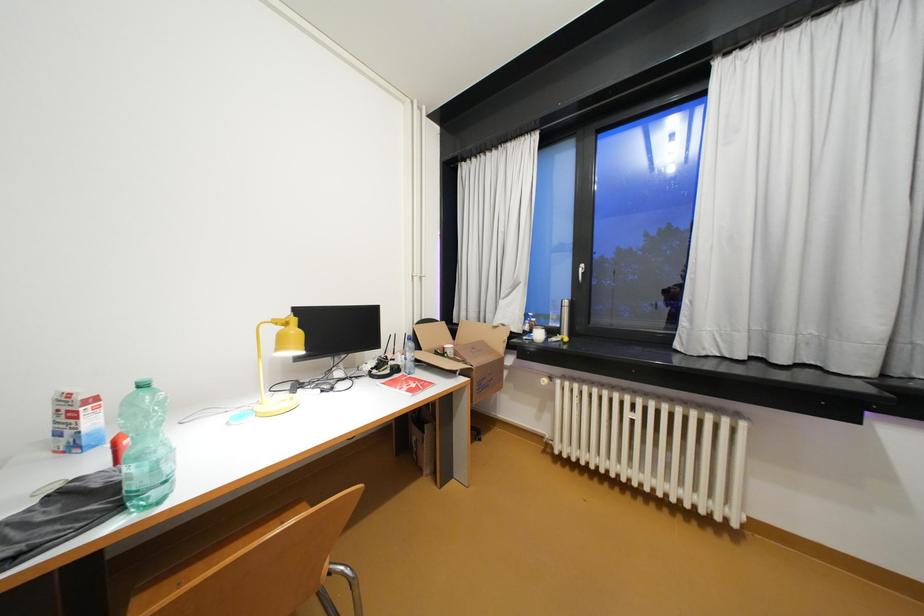
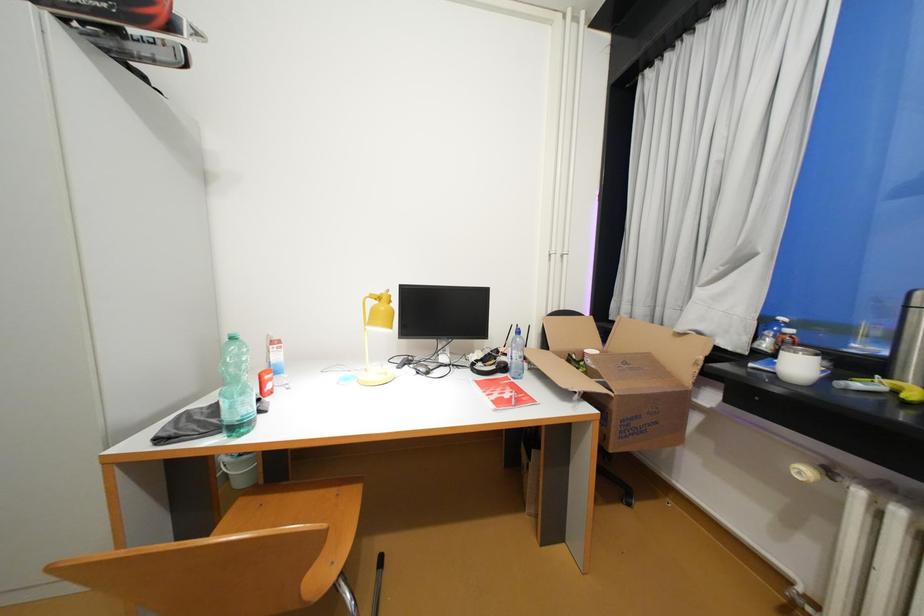
Question: Based on the continuous images, in which direction is the camera rotating? Reply with the corresponding letter.

Choices:
 (A) Left
 (B) Right
 (C) Up
 (D) Down

Answer: (A)